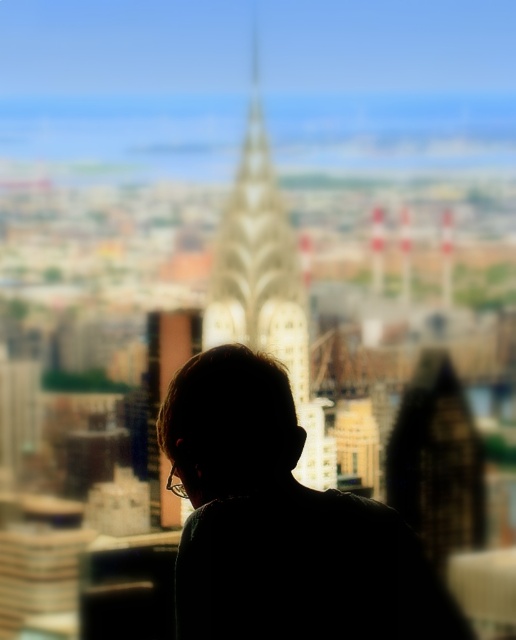
Question: From the image, what is the correct spatial relationship of silhouette hair at center in relation to white marble tower at center?

Choices:
 (A) below
 (B) above

Answer: (A)

Question: Is silhouette hair at center wider than white marble tower at center?

Choices:
 (A) no
 (B) yes

Answer: (B)

Question: Which object is positioned farthest from the transparent glass window at center?

Choices:
 (A) white marble tower at center
 (B) silhouette hair at center

Answer: (A)

Question: Estimate the real-world distances between objects in this image. Which object is farther from the white marble tower at center?

Choices:
 (A) silhouette hair at center
 (B) transparent glass window at center

Answer: (B)

Question: Which point appears closest to the camera in this image?

Choices:
 (A) (401, 611)
 (B) (351, 456)
 (C) (282, 328)

Answer: (C)

Question: Does silhouette hair at center appear on the left side of transparent glass window at center?

Choices:
 (A) yes
 (B) no

Answer: (A)